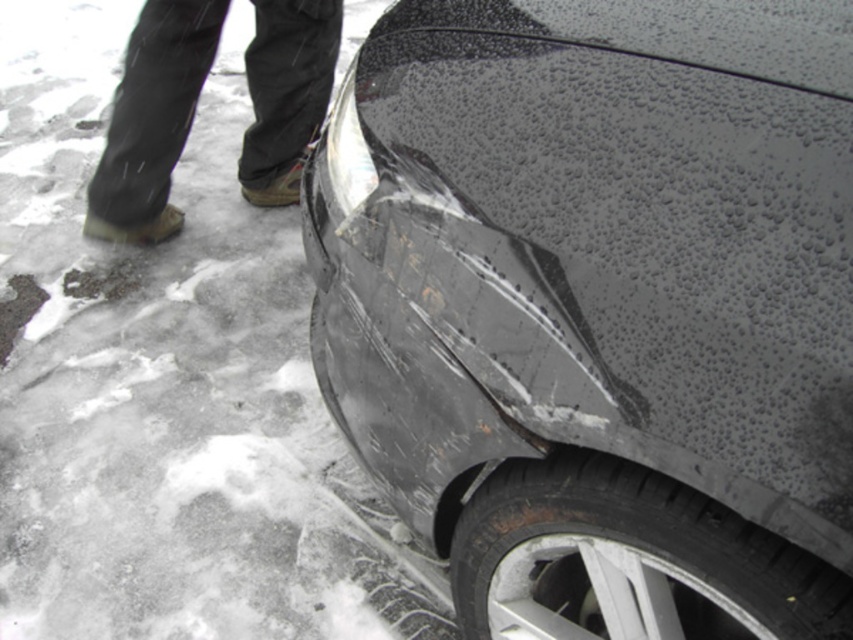
Can you confirm if glossy metallic car at center is positioned above black fabric pants at upper left?

Incorrect, glossy metallic car at center is not positioned above black fabric pants at upper left.

Where is `glossy metallic car at center`? glossy metallic car at center is located at coordinates (599, 308).

Does black rubber tire at lower right have a lesser width compared to black fabric pants at upper left?

Yes.

Does black rubber tire at lower right appear under black fabric pants at upper left?

Indeed, black rubber tire at lower right is positioned under black fabric pants at upper left.

Is point (531, 497) positioned behind point (173, 106)?

No, (531, 497) is closer to viewer.

You are a GUI agent. You are given a task and a screenshot of the screen. Output one action in this format:
    pyautogui.click(x=<x>, y=<y>)
    Task: Click on the black rubber tire at lower right
    Image resolution: width=853 pixels, height=640 pixels.
    Given the screenshot: What is the action you would take?
    pyautogui.click(x=628, y=561)

Does glossy metallic car at center have a greater width compared to black rubber tire at lower right?

Indeed, glossy metallic car at center has a greater width compared to black rubber tire at lower right.

Does glossy metallic car at center have a lesser width compared to black rubber tire at lower right?

No, glossy metallic car at center is not thinner than black rubber tire at lower right.

Consider the image. Who is more distant from viewer, (x=729, y=317) or (x=624, y=582)?

The point (x=624, y=582) is behind.

The width and height of the screenshot is (853, 640). Find the location of `glossy metallic car at center`. glossy metallic car at center is located at coordinates (599, 308).